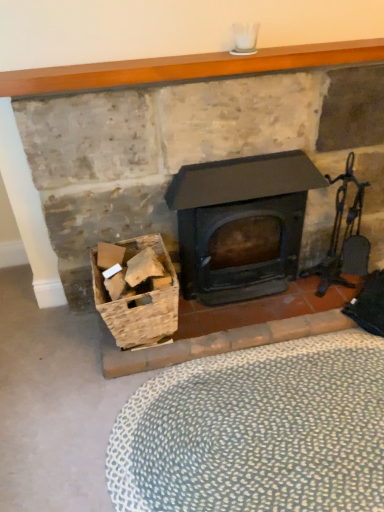
Identify the location of vacant space in front of wooden crate at lower left. This screenshot has width=384, height=512. (167, 392).